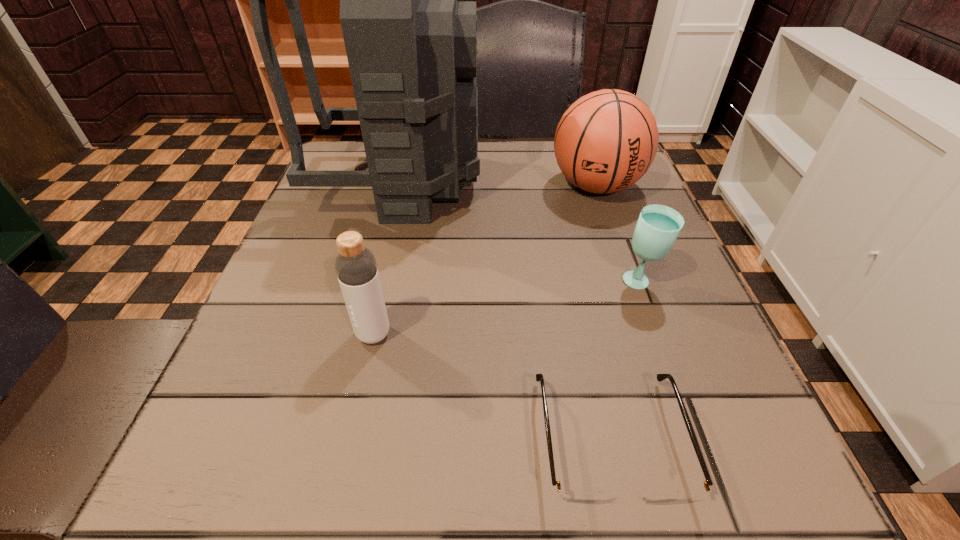
I want to click on unoccupied area between the backpack and the bottle, so click(x=387, y=259).

The height and width of the screenshot is (540, 960). In order to click on free space between the basketball and the second nearest object in this screenshot , I will do `click(485, 260)`.

Where is `empty location between the bottle and the spectacles`? The image size is (960, 540). empty location between the bottle and the spectacles is located at coordinates (492, 387).

Where is `vacant region between the second nearest object and the tallest object`? vacant region between the second nearest object and the tallest object is located at coordinates (387, 259).

The height and width of the screenshot is (540, 960). I want to click on vacant point located between the basketball and the bottle, so click(x=485, y=260).

You are a GUI agent. You are given a task and a screenshot of the screen. Output one action in this format:
    pyautogui.click(x=<x>, y=<y>)
    Task: Click on the free space between the basketball and the shortest object
    The width and height of the screenshot is (960, 540).
    Given the screenshot: What is the action you would take?
    pyautogui.click(x=603, y=313)

Where is `the closest object to the bottle`? This screenshot has height=540, width=960. the closest object to the bottle is located at coordinates (x=575, y=495).

Choose which object is the fourth nearest neighbor to the fourth tallest object. Please provide its 2D coordinates. Your answer should be formatted as a tuple, i.e. [(x, y)], where the tuple contains the x and y coordinates of a point satisfying the conditions above.

[(355, 265)]

I want to click on vacant point that satisfies the following two spatial constraints: 1. on the front compartment of the second nearest object; 2. on the right side of the backpack, so click(x=365, y=334).

You are a GUI agent. You are given a task and a screenshot of the screen. Output one action in this format:
    pyautogui.click(x=<x>, y=<y>)
    Task: Click on the vacant area that satisfies the following two spatial constraints: 1. on the front compartment of the tallest object; 2. on the right side of the fourth farthest object
    This screenshot has height=540, width=960.
    Given the screenshot: What is the action you would take?
    365,334